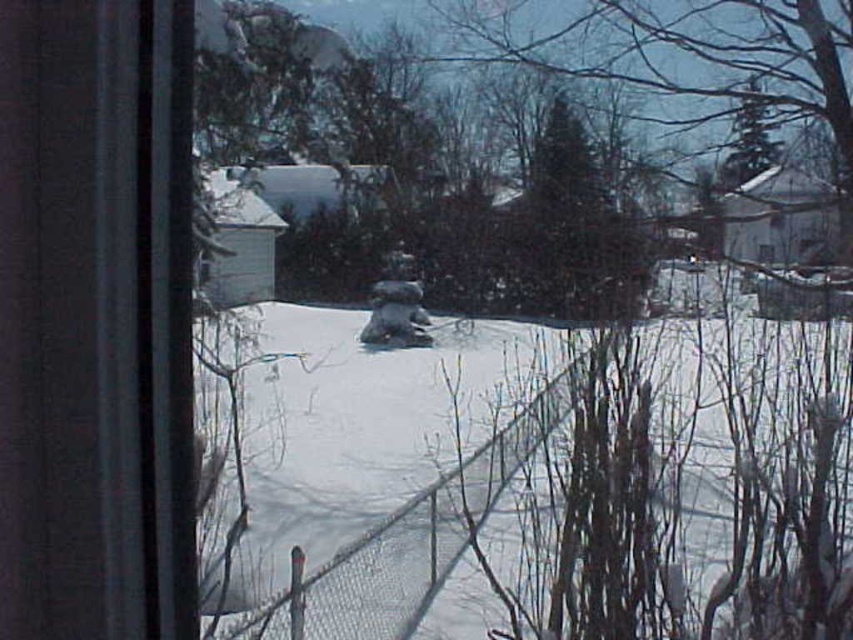
Question: Observing the image, what is the correct spatial positioning of transparent glass window at left in reference to metal mesh fence at center?

Choices:
 (A) right
 (B) left

Answer: (B)

Question: Is transparent glass window at left to the right of metal mesh fence at center from the viewer's perspective?

Choices:
 (A) yes
 (B) no

Answer: (B)

Question: Can you confirm if transparent glass window at left is positioned to the right of metal mesh fence at center?

Choices:
 (A) yes
 (B) no

Answer: (B)

Question: Which point is closer to the camera?

Choices:
 (A) metal mesh fence at center
 (B) transparent glass window at left

Answer: (B)